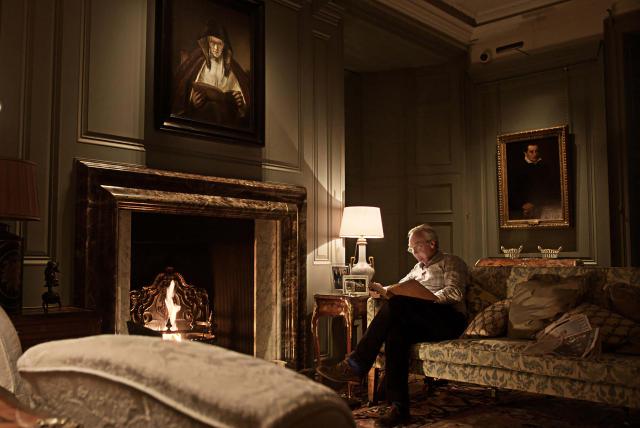
Where is `throw pillow`? throw pillow is located at coordinates (470, 298), (484, 317), (539, 300), (600, 317), (630, 302).